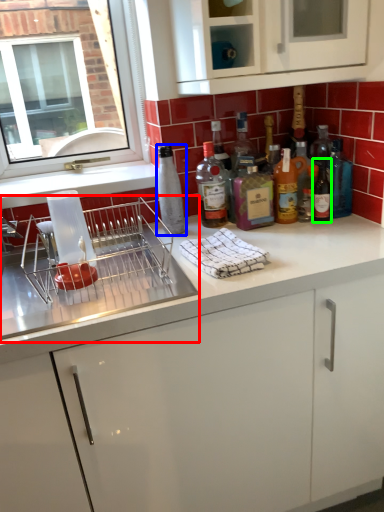
Question: Estimate the real-world distances between objects in this image. Which object is farther from appliance (highlighted by a red box), bottle (highlighted by a blue box) or wine bottle (highlighted by a green box)?

Choices:
 (A) bottle
 (B) wine bottle

Answer: (B)